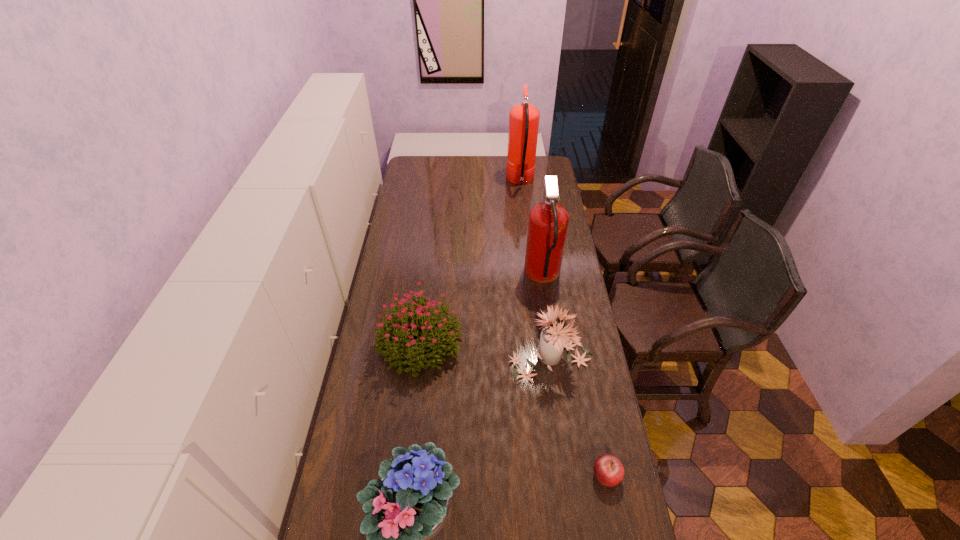
Locate an element on the screen. free location at the far left corner is located at coordinates (425, 174).

This screenshot has width=960, height=540. What are the coordinates of `vacant point located between the fifth nearest object and the apple` in the screenshot? It's located at (575, 375).

Image resolution: width=960 pixels, height=540 pixels. In order to click on empty location between the apple and the nearer fire extinguisher in this screenshot , I will do `click(575, 375)`.

The width and height of the screenshot is (960, 540). I want to click on object that ranks as the third closest to the rightmost bouquet, so click(x=609, y=471).

Locate an element on the screen. The height and width of the screenshot is (540, 960). object that stands as the fifth closest to the rightmost bouquet is located at coordinates (523, 118).

I want to click on bouquet that is the third closest to the fifth nearest object, so click(x=409, y=506).

Locate an element on the screen. This screenshot has height=540, width=960. bouquet that stands as the second closest to the rightmost bouquet is located at coordinates (409, 506).

Where is `free space that satisfies the following two spatial constraints: 1. with the handle and nozzle on the fifth nearest object; 2. on the left side of the shortest object`? The height and width of the screenshot is (540, 960). free space that satisfies the following two spatial constraints: 1. with the handle and nozzle on the fifth nearest object; 2. on the left side of the shortest object is located at coordinates coord(571,475).

Identify the location of blank area in the image that satisfies the following two spatial constraints: 1. with the handle and nozzle on the shortest object; 2. on the left side of the nearer fire extinguisher. (571, 475).

Where is `vacant space that satisfies the following two spatial constraints: 1. towards the nozzle of the farther fire extinguisher; 2. on the left side of the rightmost bouquet`? Image resolution: width=960 pixels, height=540 pixels. vacant space that satisfies the following two spatial constraints: 1. towards the nozzle of the farther fire extinguisher; 2. on the left side of the rightmost bouquet is located at coordinates (541, 358).